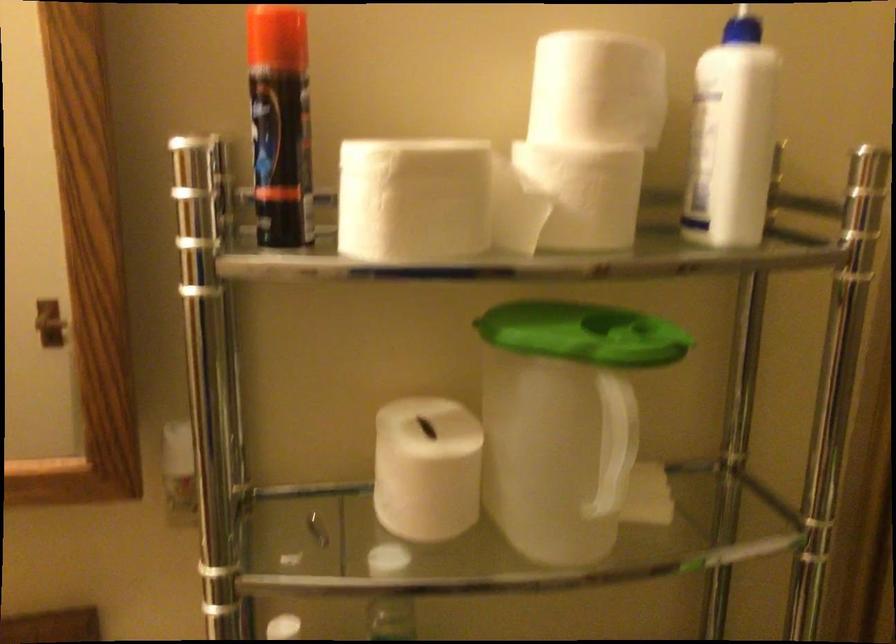
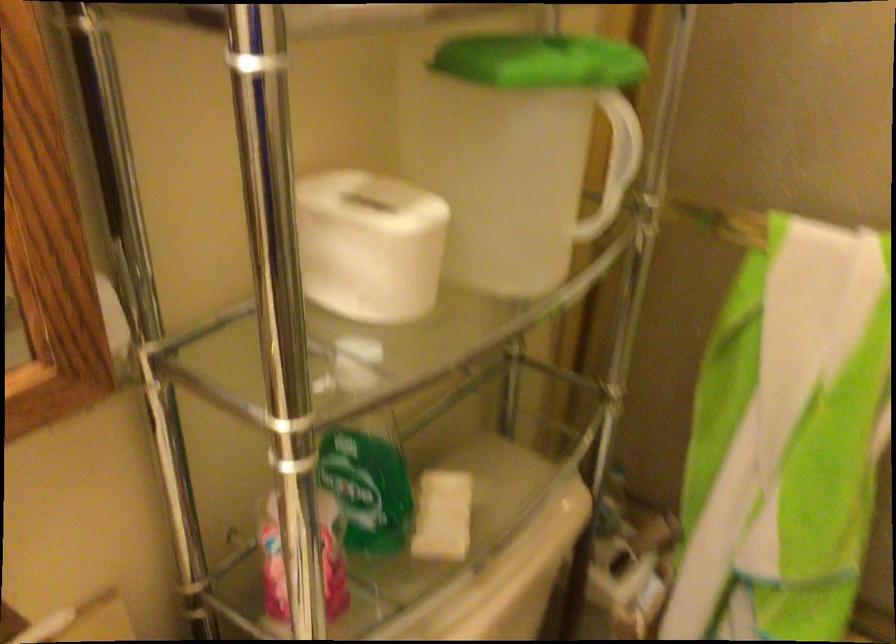
How did the camera likely rotate?

The camera's rotation is toward right-down.